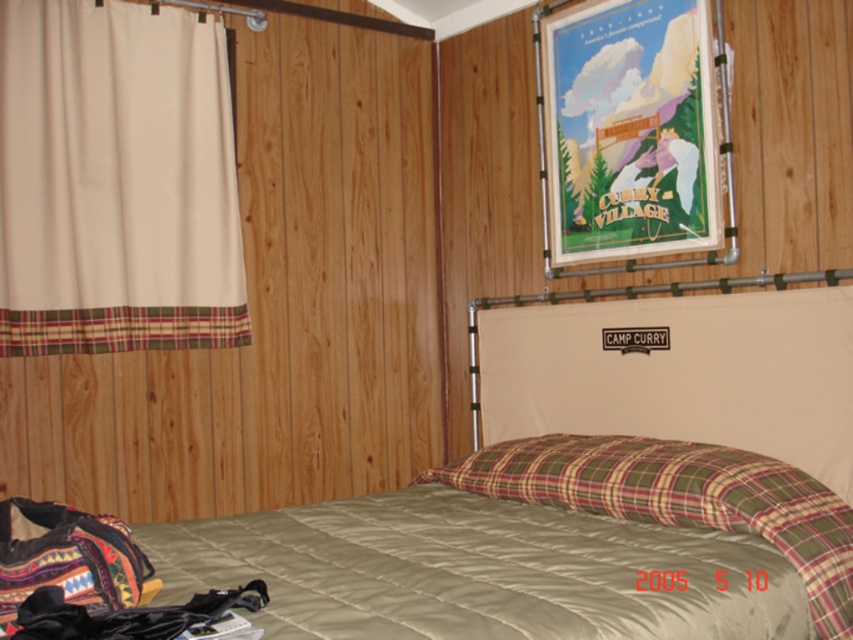
You are an interior designer assessing the wall space in this bedroom. The beige fabric curtain at left and the matte paper poster at upper center are both occupying space. Which object takes up more area on the wall?

The beige fabric curtain at left is larger in size than the matte paper poster at upper center, so it occupies more wall space.